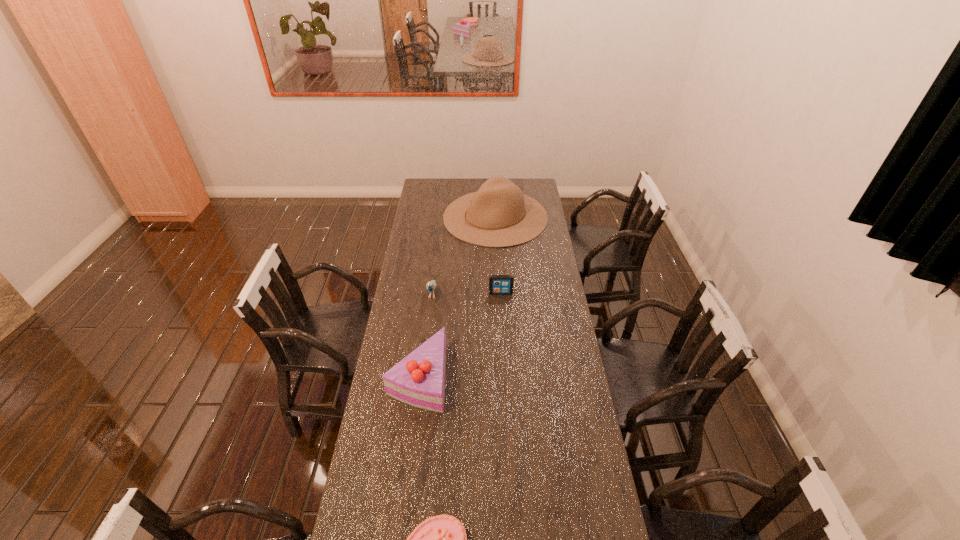
Locate an element on the screen. The width and height of the screenshot is (960, 540). object located at the far edge is located at coordinates (498, 215).

I want to click on cake situated at the left edge, so click(x=418, y=380).

In order to click on bird present at the left edge in this screenshot , I will do `click(431, 286)`.

I want to click on object situated at the right edge, so click(x=498, y=215).

The image size is (960, 540). In order to click on object positioned at the far right corner in this screenshot , I will do `click(498, 215)`.

The height and width of the screenshot is (540, 960). Identify the location of vacant space at the right edge. (539, 313).

The width and height of the screenshot is (960, 540). Find the location of `vacant space at the far left corner`. vacant space at the far left corner is located at coordinates (426, 179).

Identify the location of free space between the taller cake and the iPod. (460, 335).

Where is `vacant space in between the iPod and the bird`? vacant space in between the iPod and the bird is located at coordinates (467, 293).

The image size is (960, 540). Find the location of `vacant area that lies between the iPod and the farther cake`. vacant area that lies between the iPod and the farther cake is located at coordinates (460, 335).